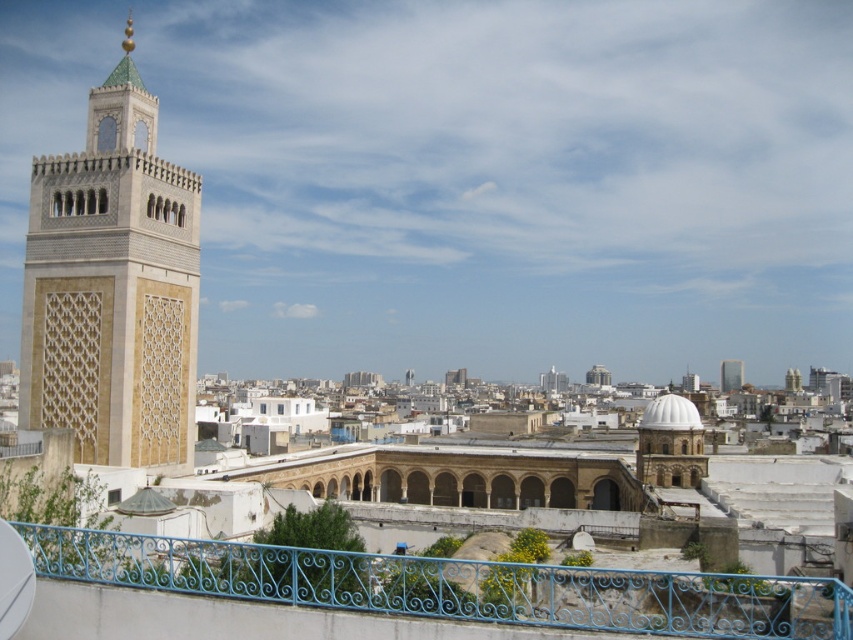
Question: Which point is farther from the camera taking this photo?

Choices:
 (A) (148, 336)
 (B) (184, 572)
 (C) (734, 358)

Answer: (C)

Question: Which point is closer to the camera?

Choices:
 (A) blue wrought iron railing at lower center
 (B) glassy reflective skyscraper at center

Answer: (A)

Question: Considering the relative positions of beige stone tower at left and blue wrought iron railing at lower center in the image provided, where is beige stone tower at left located with respect to blue wrought iron railing at lower center?

Choices:
 (A) left
 (B) right

Answer: (A)

Question: Is beige stone tower at left bigger than blue wrought iron railing at lower center?

Choices:
 (A) no
 (B) yes

Answer: (A)

Question: Based on their relative distances, which object is nearer to the blue wrought iron railing at lower center?

Choices:
 (A) beige stone tower at left
 (B) glassy reflective skyscraper at center

Answer: (A)

Question: Is blue wrought iron railing at lower center below glassy reflective skyscraper at center?

Choices:
 (A) no
 (B) yes

Answer: (A)